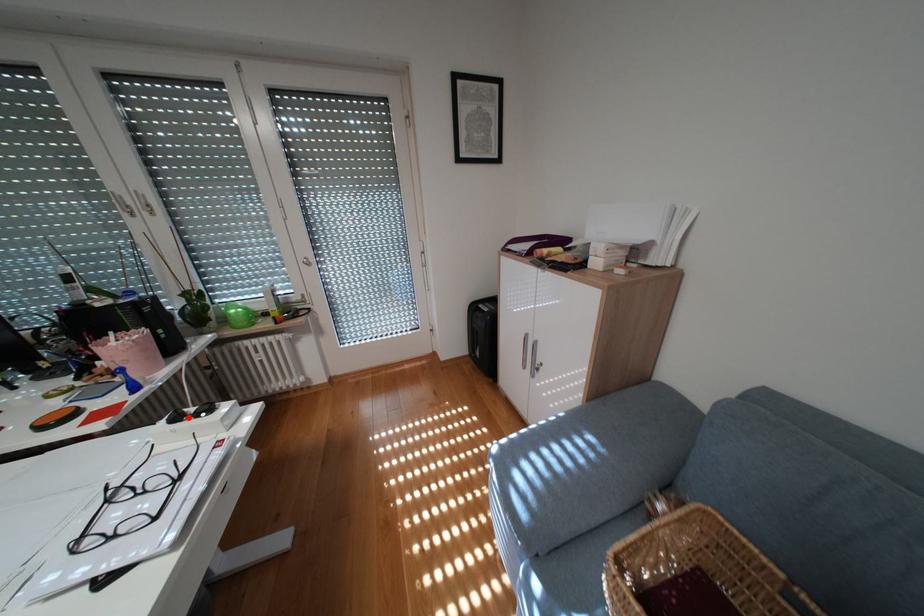
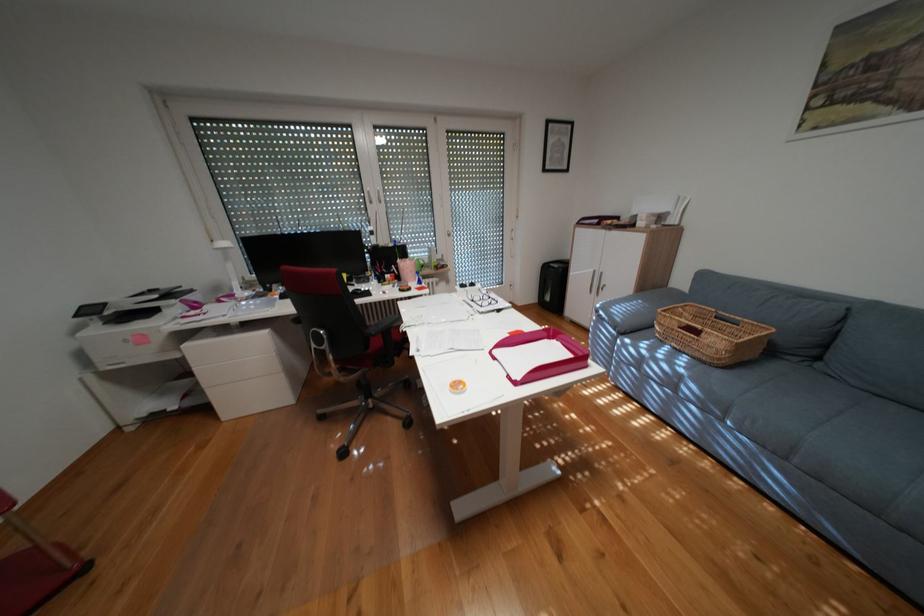
Where in the second image is the point corresponding to the highlighted location from the first image?

(476, 286)